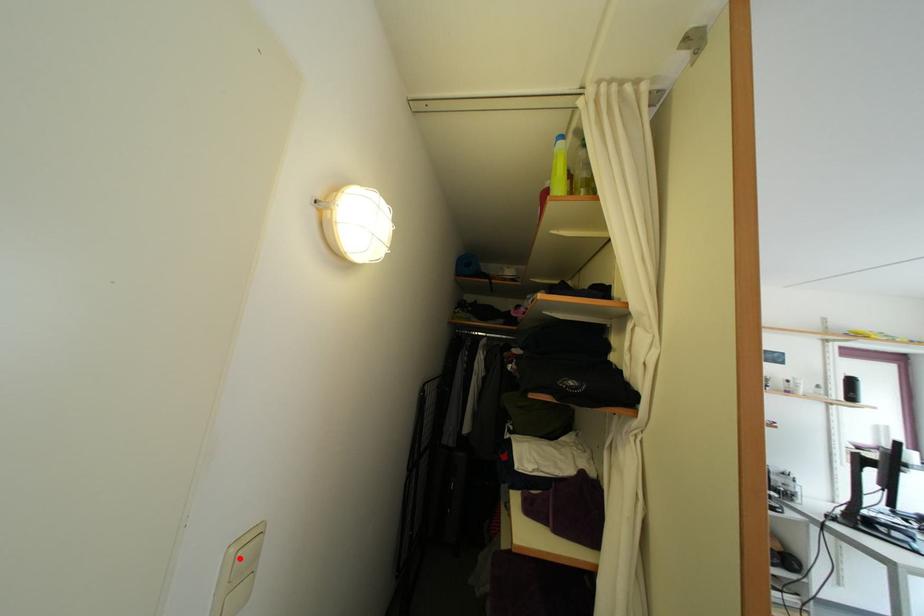
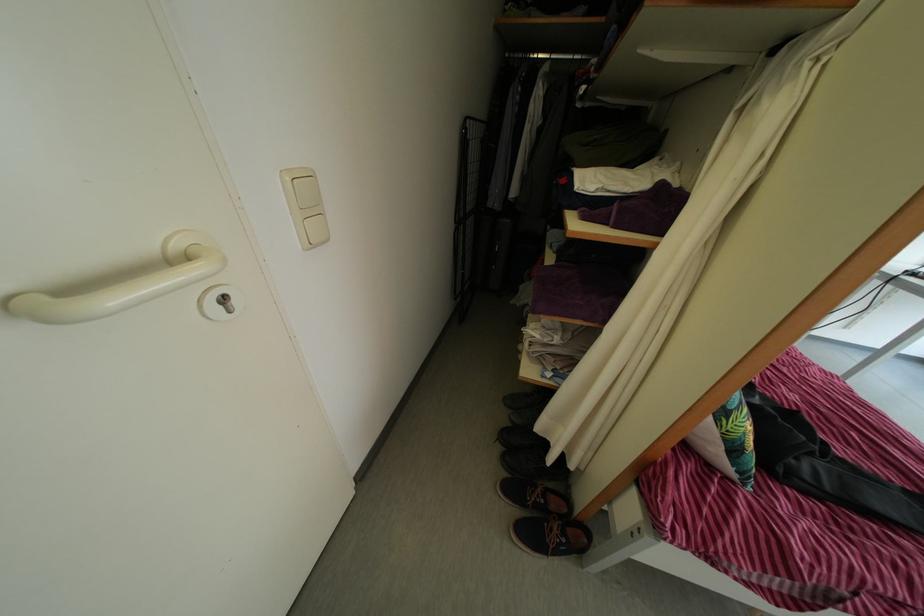
Question: I am providing you with two images of the same scene from different viewpoints. A red point is marked on the first image. At the location where the point appears in image 1, is it still visible in image 2?

Choices:
 (A) Yes
 (B) No

Answer: (A)